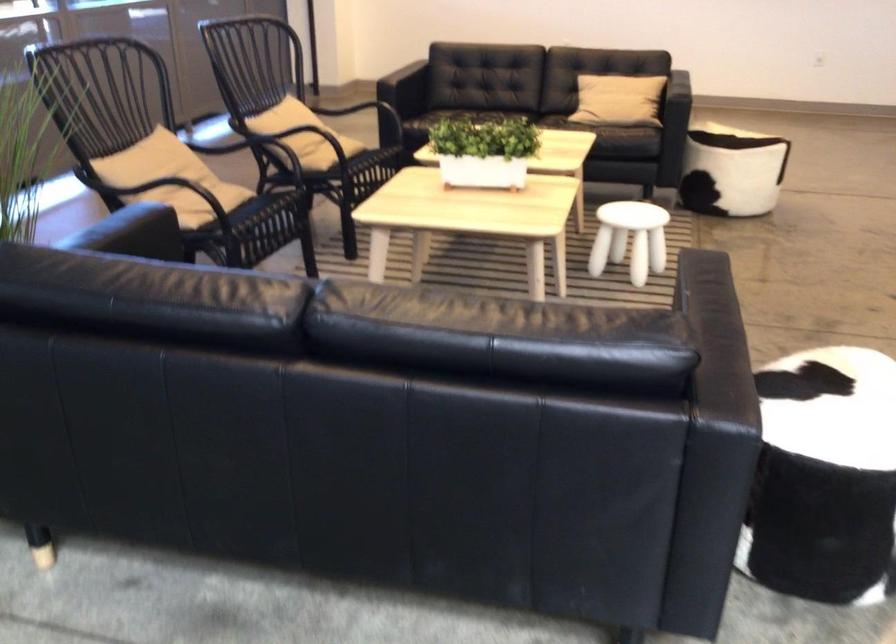
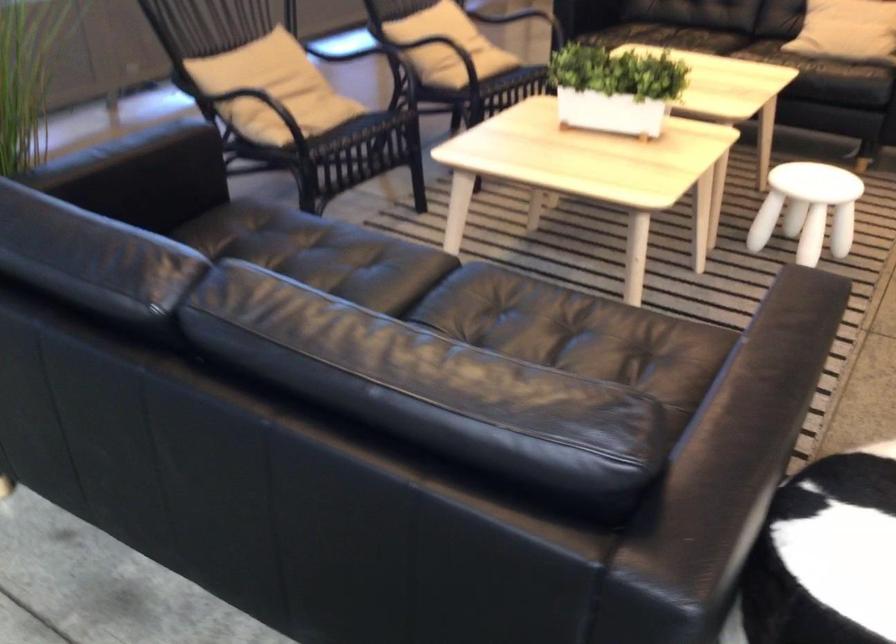
Which direction would the cameraman need to move to produce the second image?

The movement direction of the cameraman is right, forward.